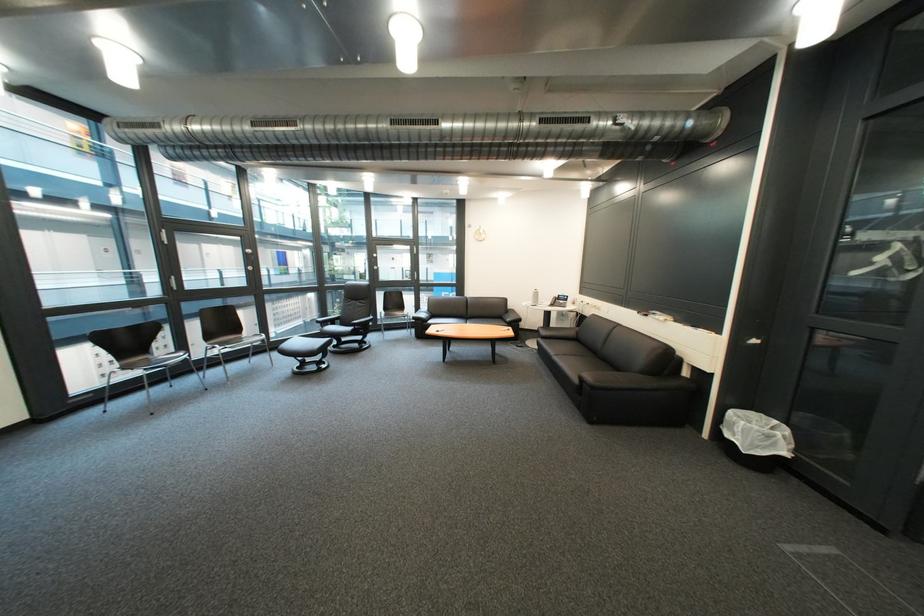
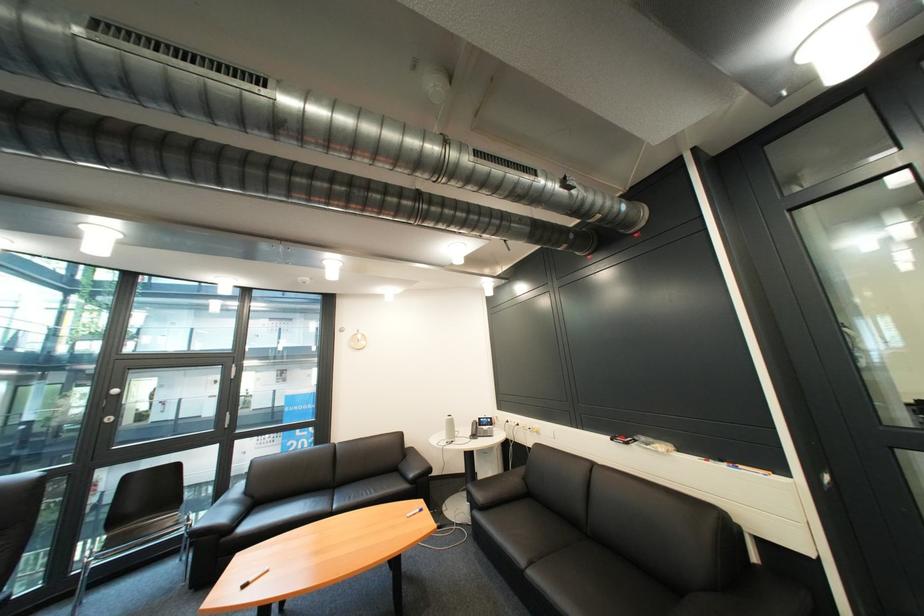
Locate, in the second image, the point that corresponds to (x=554, y=336) in the first image.

(491, 504)